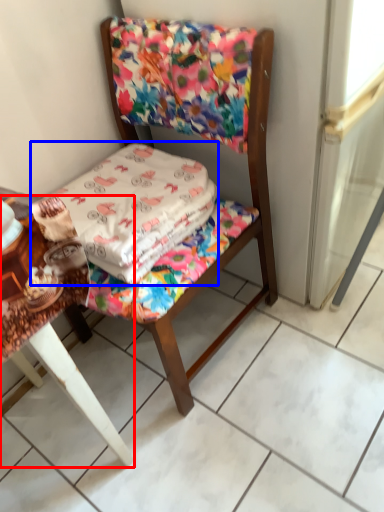
Question: Which of the following is the farthest to the observer, table (highlighted by a red box) or blanket (highlighted by a blue box)?

Choices:
 (A) table
 (B) blanket

Answer: (B)